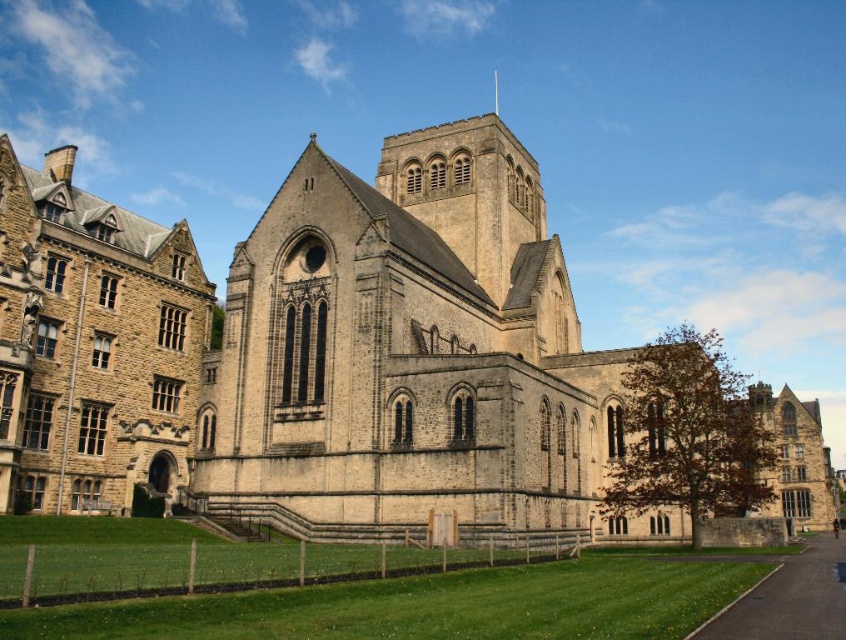
Question: Which object is positioned closest to the beige stone church at center?

Choices:
 (A) smooth silver spire at upper center
 (B) stone medieval building at left

Answer: (B)

Question: Which of the following is the farthest from the observer?

Choices:
 (A) beige stone church at center
 (B) smooth silver spire at upper center
 (C) stone medieval building at left

Answer: (B)

Question: Which of the following is the farthest from the observer?

Choices:
 (A) smooth silver spire at upper center
 (B) beige stone church at center

Answer: (A)

Question: Is beige stone church at center wider than stone medieval building at left?

Choices:
 (A) yes
 (B) no

Answer: (A)

Question: Does beige stone church at center have a smaller size compared to stone medieval building at left?

Choices:
 (A) no
 (B) yes

Answer: (A)

Question: Is stone medieval building at left behind smooth silver spire at upper center?

Choices:
 (A) yes
 (B) no

Answer: (B)